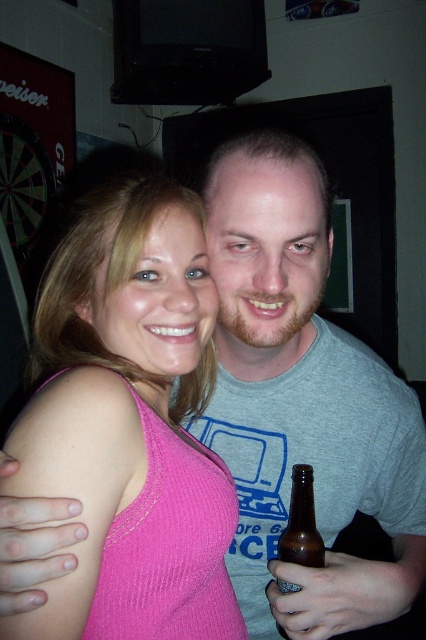
Looking at this image, based on the scene description, what are the coordinates of the pink ribbed tank top at center?

The pink ribbed tank top at center is located at coordinates point (129, 424).

You are a photographer trying to capture a closeup of the pink ribbed tank top at center and the brown glass bottle at lower right. Since you want to focus on both objects clearly, which one should you adjust your camera focus on first considering their sizes?

The pink ribbed tank top at center has a larger size compared to brown glass bottle at lower right, so you should focus on the pink ribbed tank top at center first to ensure it is in clear focus before adjusting for the smaller bottle.